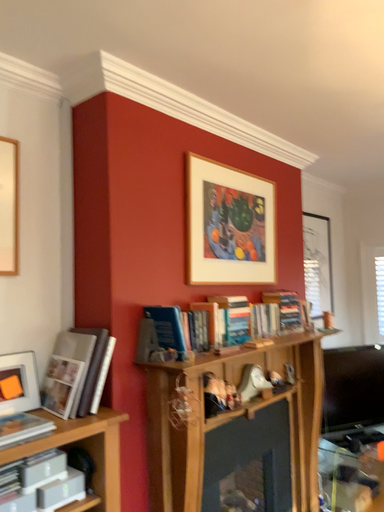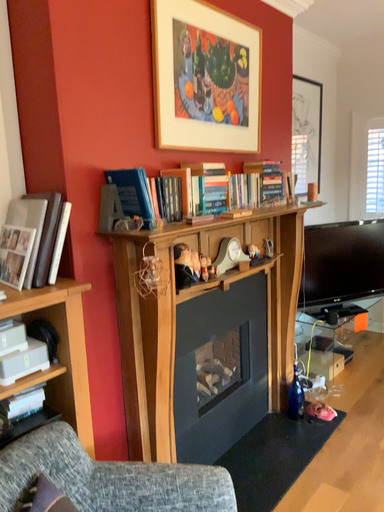
Question: Which way did the camera rotate in the video?

Choices:
 (A) rotated upward
 (B) rotated downward

Answer: (B)